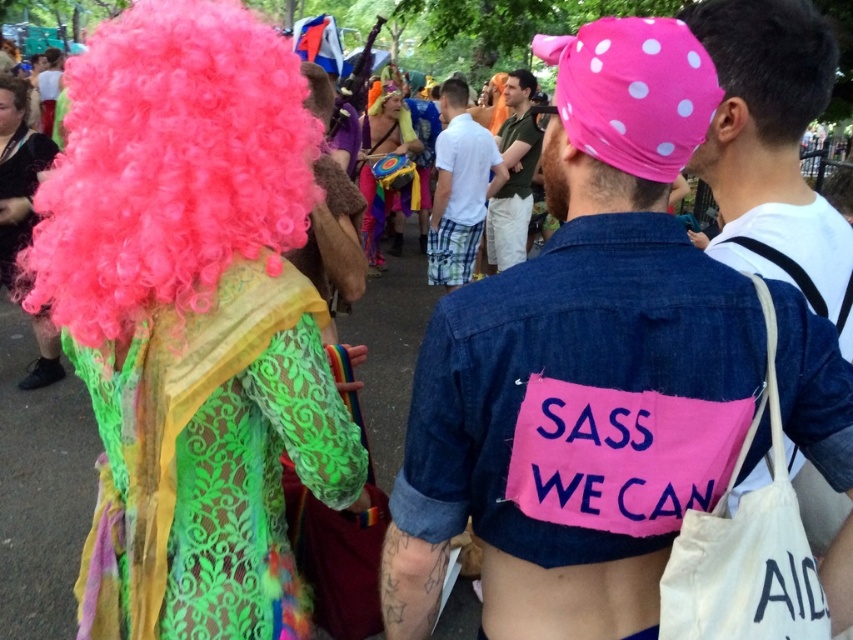
Is fluffy pink wig at upper left smaller than black smooth hair at upper center?

No.

Does fluffy pink wig at upper left have a lesser width compared to black smooth hair at upper center?

No, fluffy pink wig at upper left is not thinner than black smooth hair at upper center.

Which is in front, point (271, 218) or point (732, 54)?

Point (271, 218) is in front.

Where is `fluffy pink wig at upper left`? fluffy pink wig at upper left is located at coordinates coord(169,166).

Locate an element on the screen. This screenshot has height=640, width=853. neon pink wig at center is located at coordinates (386, 157).

Based on the photo, can you confirm if neon pink wig at center is wider than brown curly hair at center?

Indeed, neon pink wig at center has a greater width compared to brown curly hair at center.

Which is in front, point (366, 118) or point (450, 84)?

Positioned in front is point (450, 84).

Where is `neon pink wig at center`? This screenshot has width=853, height=640. neon pink wig at center is located at coordinates pos(386,157).

Is black smooth hair at upper center wider than white cotton shirt at center?

A: In fact, black smooth hair at upper center might be narrower than white cotton shirt at center.

Can you confirm if black smooth hair at upper center is taller than white cotton shirt at center?

Incorrect, black smooth hair at upper center's height is not larger of white cotton shirt at center's.

The image size is (853, 640). Find the location of `black smooth hair at upper center`. black smooth hair at upper center is located at coordinates (769, 60).

In order to click on black smooth hair at upper center in this screenshot , I will do `click(769, 60)`.